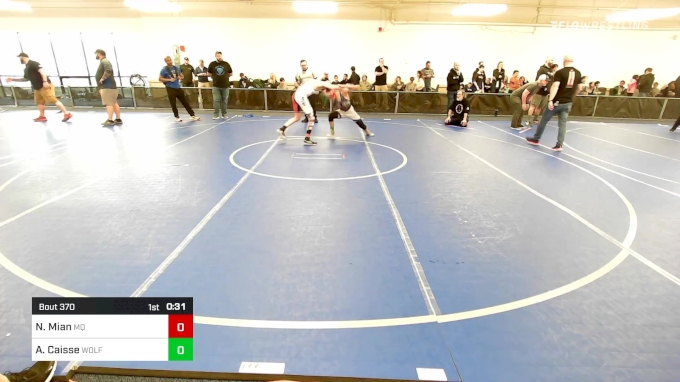
Image resolution: width=680 pixels, height=382 pixels. Identify the location of wrestling mat. pos(271,243).